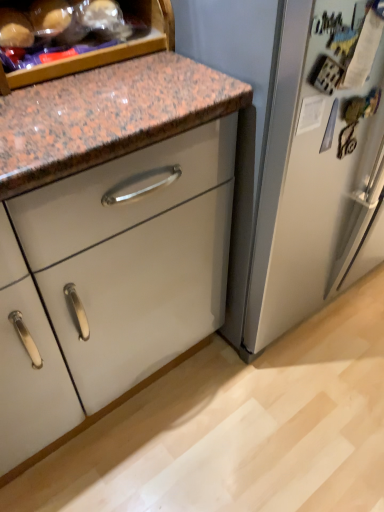
The width and height of the screenshot is (384, 512). Identify the location of translucent plastic bag at upper left. (75, 35).

The width and height of the screenshot is (384, 512). Describe the element at coordinates (75, 35) in the screenshot. I see `translucent plastic bag at upper left` at that location.

What is the approximate height of translucent plastic bag at upper left?

7.24 inches.

This screenshot has height=512, width=384. Describe the element at coordinates (110, 237) in the screenshot. I see `white glossy cabinet at center` at that location.

Locate an element on the screen. white glossy cabinet at center is located at coordinates (110, 237).

The width and height of the screenshot is (384, 512). Find the location of `translucent plastic bag at upper left`. translucent plastic bag at upper left is located at coordinates (75, 35).

Is translucent plastic bag at upper left to the left of white glossy cabinet at center from the viewer's perspective?

Correct, you'll find translucent plastic bag at upper left to the left of white glossy cabinet at center.

Is translucent plastic bag at upper left further to the viewer compared to white glossy cabinet at center?

That is False.

Which is nearer, [51,42] or [72,213]?

Clearly, point [51,42] is more distant from the camera than point [72,213].

From the image's perspective, is translucent plastic bag at upper left on white glossy cabinet at center?

Indeed, from the image's perspective, translucent plastic bag at upper left is shown above white glossy cabinet at center.

From a real-world perspective, who is located higher, translucent plastic bag at upper left or white glossy cabinet at center?

In real-world perspective, translucent plastic bag at upper left is above.

Between translucent plastic bag at upper left and white glossy cabinet at center, which one has larger width?

white glossy cabinet at center is wider.

In terms of height, does translucent plastic bag at upper left look taller or shorter compared to white glossy cabinet at center?

Clearly, translucent plastic bag at upper left is taller compared to white glossy cabinet at center.

Can you confirm if translucent plastic bag at upper left is bigger than white glossy cabinet at center?

No.

Is translucent plastic bag at upper left completely or partially outside of white glossy cabinet at center?

Yes, translucent plastic bag at upper left is not within white glossy cabinet at center.

Is translucent plastic bag at upper left positioned far away from white glossy cabinet at center?

No, translucent plastic bag at upper left is not far away from white glossy cabinet at center.

Is translucent plastic bag at upper left oriented towards white glossy cabinet at center?

No, translucent plastic bag at upper left is not turned towards white glossy cabinet at center.

From the picture: How many degrees apart are the facing directions of translucent plastic bag at upper left and white glossy cabinet at center?

There is a 89.2-degree angle between the facing directions of translucent plastic bag at upper left and white glossy cabinet at center.

How far apart are translucent plastic bag at upper left and white glossy cabinet at center?

15.24 inches.

Where is `cabinetry below the translucent plastic bag at upper left (from a real-world perspective)`? The image size is (384, 512). cabinetry below the translucent plastic bag at upper left (from a real-world perspective) is located at coordinates (110, 237).

Does white glossy cabinet at center appear on the right side of translucent plastic bag at upper left?

Indeed, white glossy cabinet at center is positioned on the right side of translucent plastic bag at upper left.

Relative to translucent plastic bag at upper left, is white glossy cabinet at center in front or behind?

white glossy cabinet at center is positioned farther from the viewer than translucent plastic bag at upper left.

Is point (136, 387) positioned before point (54, 51)?

No.

From the image's perspective, relative to translucent plastic bag at upper left, is white glossy cabinet at center above or below?

white glossy cabinet at center is below translucent plastic bag at upper left.

Consider the image. From a real-world perspective, is white glossy cabinet at center on translucent plastic bag at upper left?

No, from a real-world perspective, white glossy cabinet at center is not above translucent plastic bag at upper left.

Which of these two, white glossy cabinet at center or translucent plastic bag at upper left, is thinner?

translucent plastic bag at upper left is thinner.

Considering the sizes of objects white glossy cabinet at center and translucent plastic bag at upper left in the image provided, who is taller, white glossy cabinet at center or translucent plastic bag at upper left?

translucent plastic bag at upper left is taller.

Who is smaller, white glossy cabinet at center or translucent plastic bag at upper left?

translucent plastic bag at upper left is smaller.

Would you say white glossy cabinet at center contains translucent plastic bag at upper left?

Actually, translucent plastic bag at upper left is outside white glossy cabinet at center.

Is there a large distance between white glossy cabinet at center and translucent plastic bag at upper left?

No, white glossy cabinet at center is not far from translucent plastic bag at upper left.

Could you tell me if white glossy cabinet at center is turned towards translucent plastic bag at upper left?

No, white glossy cabinet at center is not turned towards translucent plastic bag at upper left.

How many degrees apart are the facing directions of white glossy cabinet at center and translucent plastic bag at upper left?

89.2 degrees.

Find the location of a particular element. The height and width of the screenshot is (512, 384). food lying above the white glossy cabinet at center (from the image's perspective) is located at coordinates (75, 35).

Where is `food lying in front of the white glossy cabinet at center`? food lying in front of the white glossy cabinet at center is located at coordinates (75, 35).

In the image, there is a white glossy cabinet at center. At what (x,y) coordinates should I click in order to perform the action: click on food above it (from the image's perspective). Please return your answer as a coordinate pair (x, y). This screenshot has height=512, width=384. Looking at the image, I should click on (75, 35).